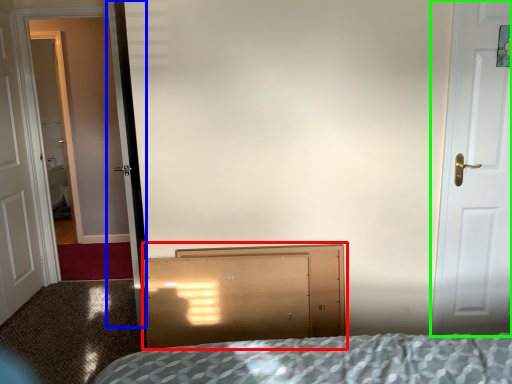
Question: Which object is the farthest from dresser (highlighted by a red box)? Choose among these: screen door (highlighted by a blue box) or door (highlighted by a green box).

Choices:
 (A) screen door
 (B) door

Answer: (B)